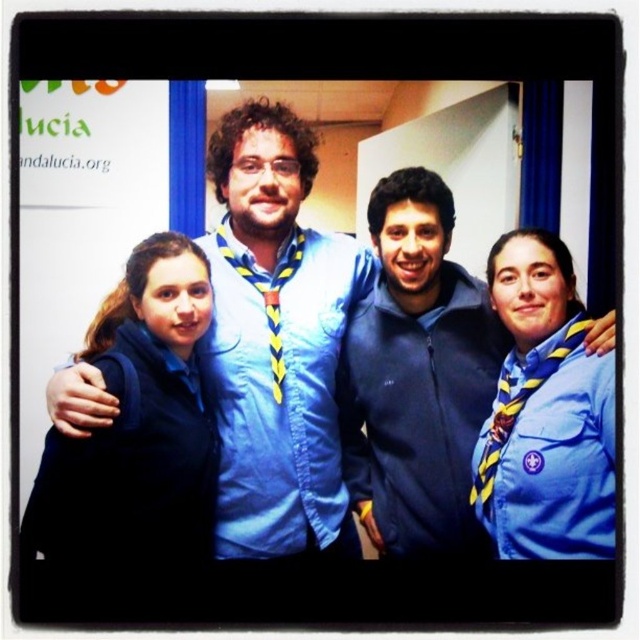
Describe the element at coordinates (276, 340) in the screenshot. I see `blue denim shirt at center` at that location.

Based on the photo, which is below, blue denim shirt at center or matte blue uniform at left?

matte blue uniform at left is below.

Is point (228, 150) closer to camera compared to point (138, 522)?

No, (228, 150) is further to viewer.

Locate an element on the screen. Image resolution: width=640 pixels, height=640 pixels. blue denim shirt at center is located at coordinates (276, 340).

Is blue denim shirt at center below blue fabric shirt at center?

No.

You are a GUI agent. You are given a task and a screenshot of the screen. Output one action in this format:
    pyautogui.click(x=<x>, y=<y>)
    Task: Click on the blue denim shirt at center
    Image resolution: width=640 pixels, height=640 pixels.
    Given the screenshot: What is the action you would take?
    pyautogui.click(x=276, y=340)

Looking at this image, is blue fabric shirt at center positioned before navy blue fleece jacket at center?

Yes, it is.

Is point (472, 532) less distant than point (412, 388)?

Yes.

Locate an element on the screen. blue fabric shirt at center is located at coordinates (417, 376).